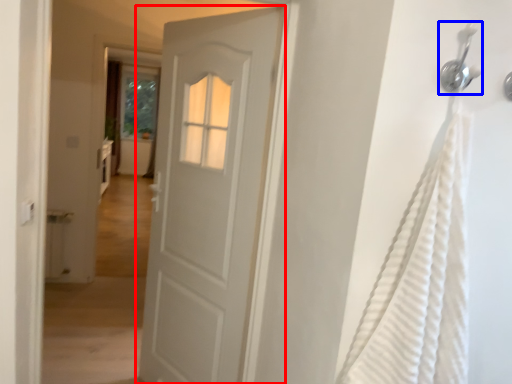
Question: Which object is further to the camera taking this photo, door (highlighted by a red box) or shower (highlighted by a blue box)?

Choices:
 (A) door
 (B) shower

Answer: (A)